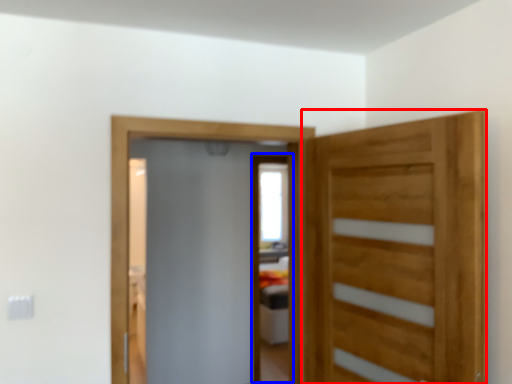
Question: Which of the following is the farthest to the observer, door (highlighted by a red box) or screen door (highlighted by a blue box)?

Choices:
 (A) door
 (B) screen door

Answer: (B)